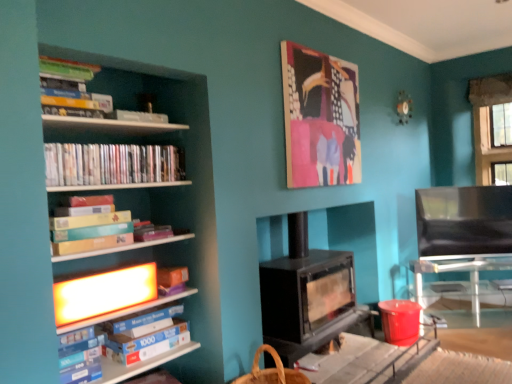
Image resolution: width=512 pixels, height=384 pixels. I want to click on blank space situated above canvas painting at upper center (from a real-world perspective), so click(x=321, y=54).